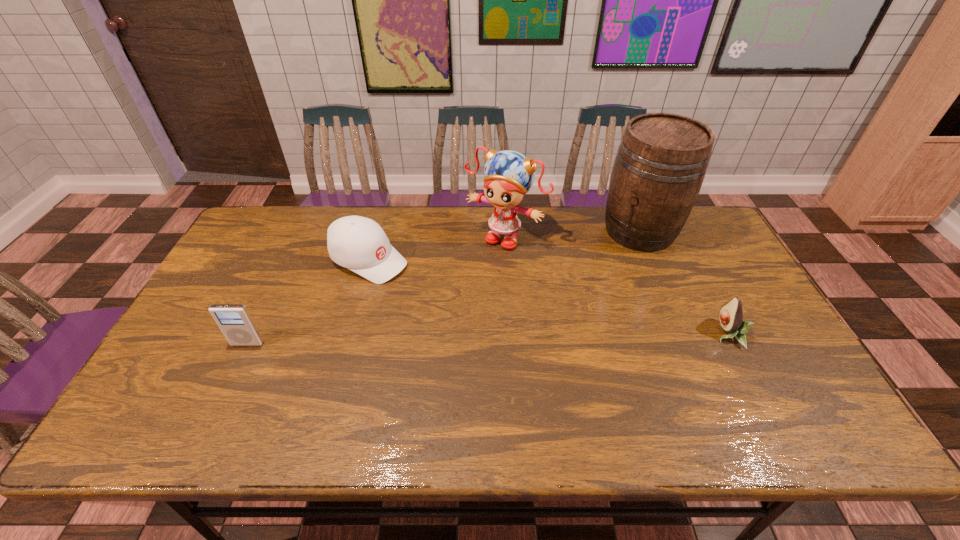
This screenshot has height=540, width=960. In order to click on cider located in the far edge section of the desktop in this screenshot , I will do `click(660, 165)`.

What are the coordinates of `baseball cap that is at the far edge` in the screenshot? It's located at (357, 243).

Identify the location of object at the left edge. This screenshot has width=960, height=540. (234, 320).

Image resolution: width=960 pixels, height=540 pixels. Identify the location of avocado located at the right edge. (731, 314).

Find the location of `cider located at the right edge`. cider located at the right edge is located at coordinates (660, 165).

At what (x,y) coordinates should I click in order to perform the action: click on object present at the far right corner. Please return your answer as a coordinate pair (x, y). This screenshot has width=960, height=540. Looking at the image, I should click on (660, 165).

Identify the location of free space at the far edge. (394, 206).

The image size is (960, 540). Find the location of `vacant space at the near edge`. vacant space at the near edge is located at coordinates (336, 390).

The height and width of the screenshot is (540, 960). I want to click on blank area at the left edge, so click(261, 251).

Where is `free space at the right edge of the desktop`? free space at the right edge of the desktop is located at coordinates (761, 343).